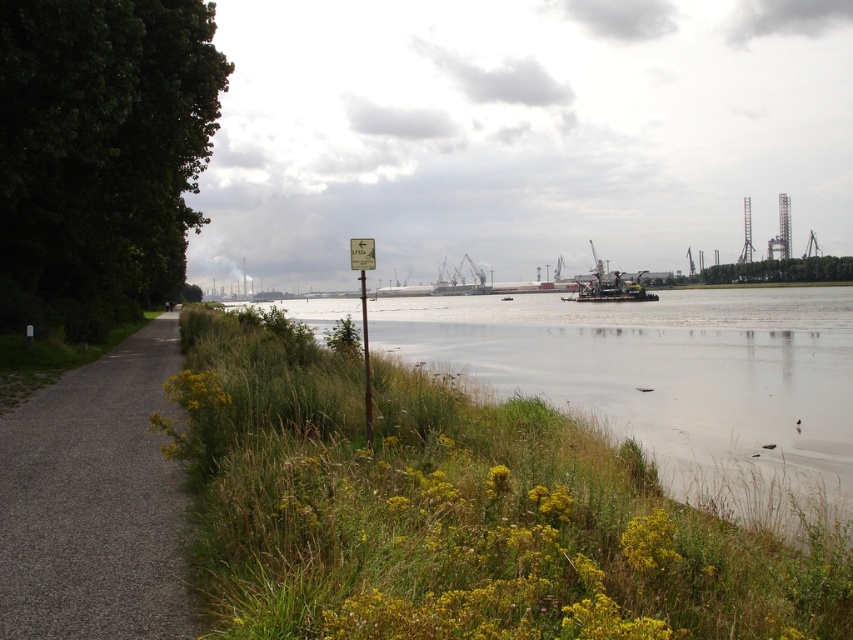
Question: Observing the image, what is the correct spatial positioning of gravel path at left in reference to green plastic sign at center?

Choices:
 (A) below
 (B) above

Answer: (A)

Question: Among these points, which one is nearest to the camera?

Choices:
 (A) [351, 256]
 (B) [178, 486]

Answer: (B)

Question: From the image, what is the correct spatial relationship of gravel path at left in relation to green plastic sign at center?

Choices:
 (A) above
 (B) below

Answer: (B)

Question: Is the position of gravel path at left less distant than that of green plastic sign at center?

Choices:
 (A) yes
 (B) no

Answer: (A)

Question: Which point is farther to the camera?

Choices:
 (A) green plastic sign at center
 (B) gravel path at left

Answer: (A)